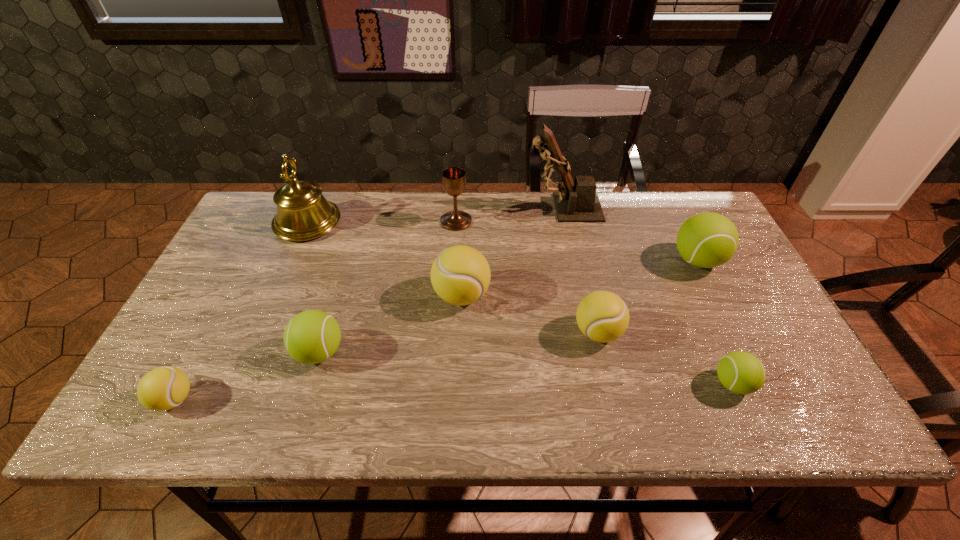
At what (x,y) coordinates should I click in order to perform the action: click on free space that is in between the chalice and the eighth shortest object. Please return your answer as a coordinate pair (x, y). The image size is (960, 540). Looking at the image, I should click on [382, 221].

Where is `free space between the chalice and the biggest green tennis ball`? The height and width of the screenshot is (540, 960). free space between the chalice and the biggest green tennis ball is located at coordinates (577, 241).

At what (x,y) coordinates should I click in order to perform the action: click on vacant area between the fourth tennis ball from left to right and the chalice. Please return your answer as a coordinate pair (x, y). This screenshot has height=540, width=960. Looking at the image, I should click on (527, 276).

Where is `blank region between the second biggest green tennis ball and the smallest green tennis ball`? Image resolution: width=960 pixels, height=540 pixels. blank region between the second biggest green tennis ball and the smallest green tennis ball is located at coordinates (526, 368).

This screenshot has height=540, width=960. What are the coordinates of `free space between the figurine and the rightmost yellow tennis ball` in the screenshot? It's located at (581, 270).

Image resolution: width=960 pixels, height=540 pixels. Identify the location of object that ranks as the sixth closest to the smallest green tennis ball. (313, 336).

This screenshot has height=540, width=960. Find the location of `the seventh closest object to the fourth tennis ball from left to right`. the seventh closest object to the fourth tennis ball from left to right is located at coordinates (303, 213).

Locate an element on the screen. The height and width of the screenshot is (540, 960). tennis ball that is the fourth closest to the gold bell is located at coordinates (602, 316).

Point out which tennis ball is positioned as the nearest to the gold bell. Please provide its 2D coordinates. Your answer should be formatted as a tuple, i.e. [(x, y)], where the tuple contains the x and y coordinates of a point satisfying the conditions above.

[(313, 336)]

Select which yellow tennis ball is the closest to the farthest green tennis ball. Please provide its 2D coordinates. Your answer should be formatted as a tuple, i.e. [(x, y)], where the tuple contains the x and y coordinates of a point satisfying the conditions above.

[(602, 316)]